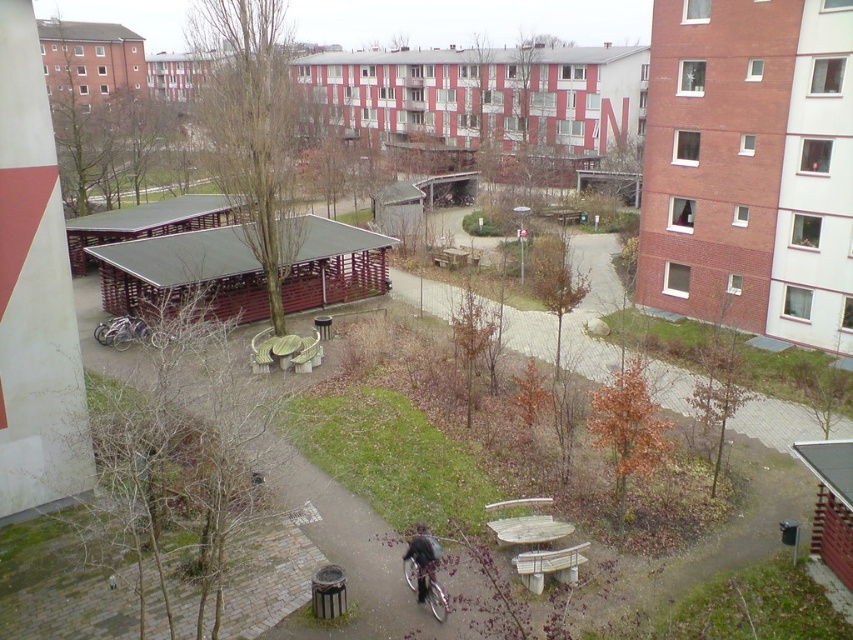
Question: Is brick paved path at center further to the viewer compared to dark gray fabric jacket at lower center?

Choices:
 (A) yes
 (B) no

Answer: (A)

Question: Does brick paved path at center appear under silver metallic bicycle at center?

Choices:
 (A) yes
 (B) no

Answer: (B)

Question: Which point is farther from the camera taking this photo?

Choices:
 (A) pyautogui.click(x=683, y=404)
 (B) pyautogui.click(x=566, y=579)

Answer: (A)

Question: Which object is positioned closest to the silver metallic bicycle at center?

Choices:
 (A) wooden picnic table at center
 (B) dark gray fabric jacket at lower center
 (C) brick paved path at center

Answer: (B)

Question: Which point is farther from the camera taking this photo?

Choices:
 (A) (541, 538)
 (B) (418, 563)

Answer: (A)

Question: Can you confirm if wooden picnic table at center is positioned to the right of dark gray fabric jacket at lower center?

Choices:
 (A) no
 (B) yes

Answer: (B)